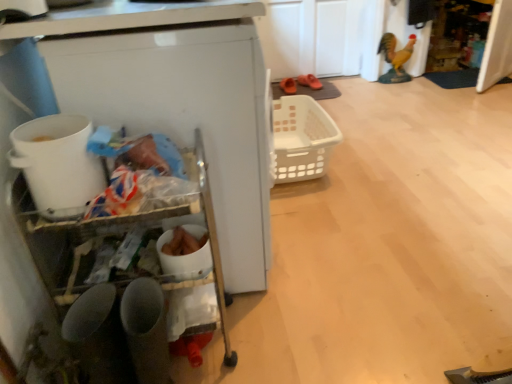
Identify the location of vacant area that lies between shiny gold statue at upper right and white plastic basket at center. (362, 118).